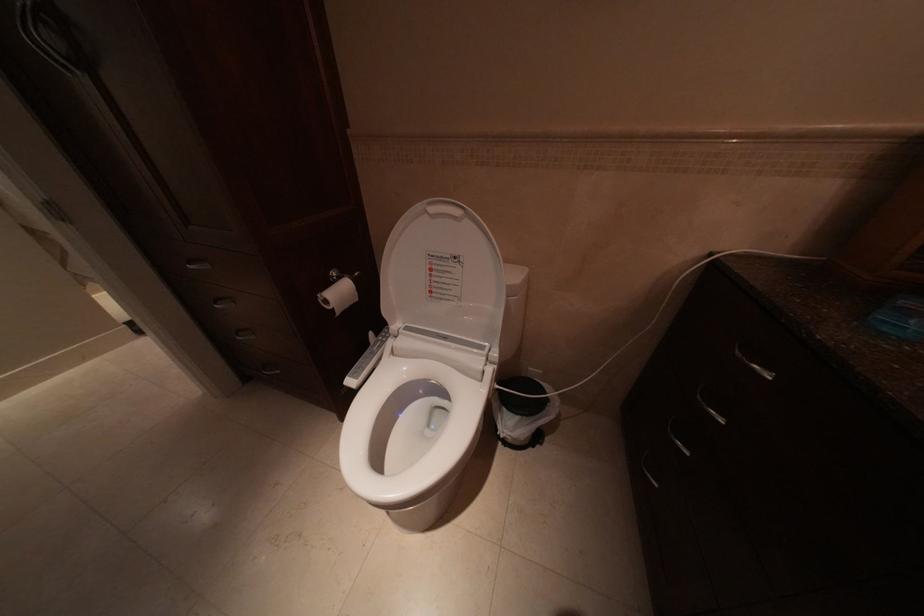
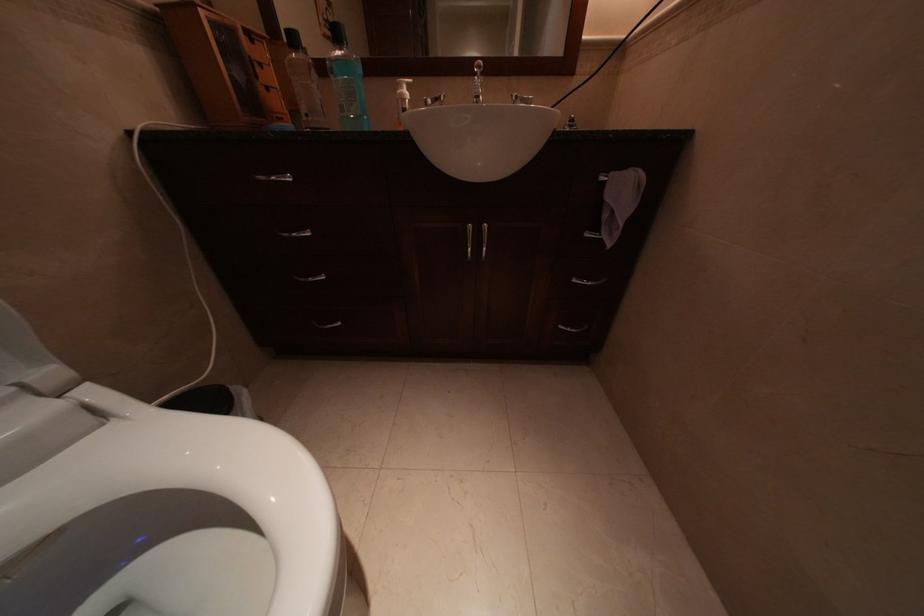
First-person continuous shooting, in which direction is the camera rotating?

The camera rotated toward right-down.